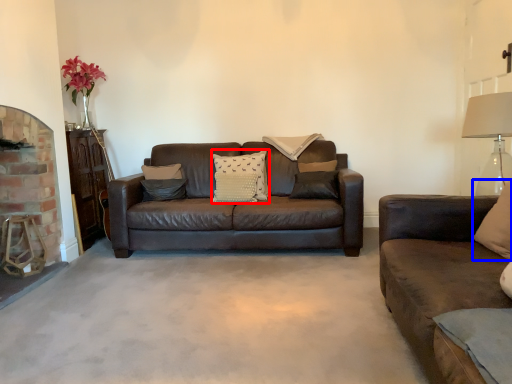
Question: Which object appears closest to the camera in this image, pillow (highlighted by a red box) or pillow (highlighted by a blue box)?

Choices:
 (A) pillow
 (B) pillow

Answer: (B)